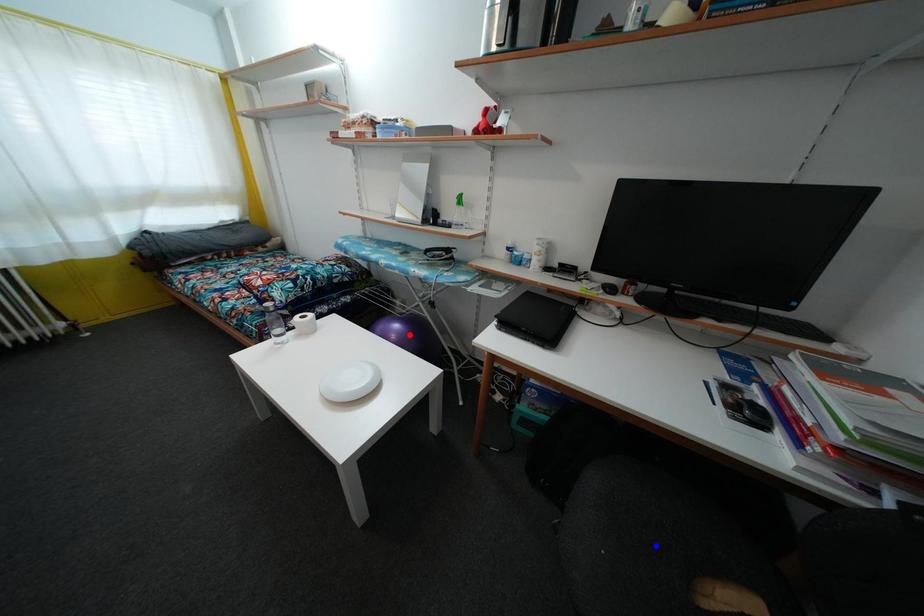
Question: Which of the two points in the image is closer to the camera?

Choices:
 (A) Blue point is closer.
 (B) Red point is closer.

Answer: (A)